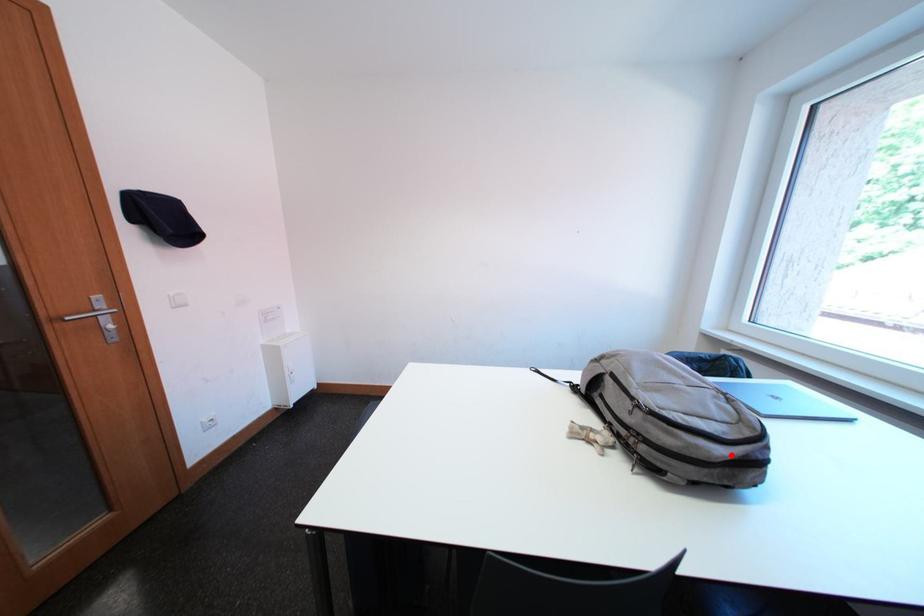
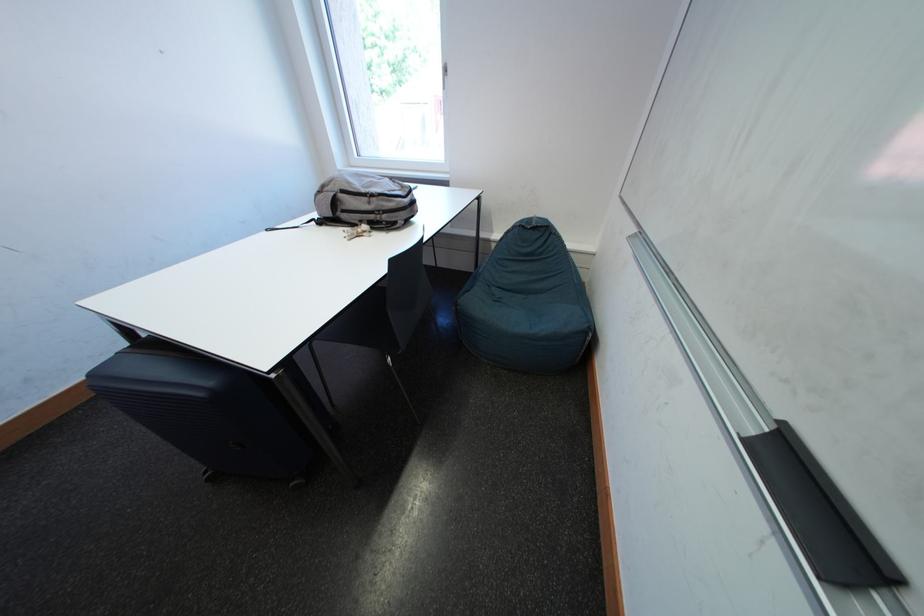
Question: A red point is marked in image1. In image2, is the corresponding 3D point closer to the camera or farther? Reply with the corresponding letter.

Choices:
 (A) The corresponding 3D point is closer.
 (B) The corresponding 3D point is farther.

Answer: (A)